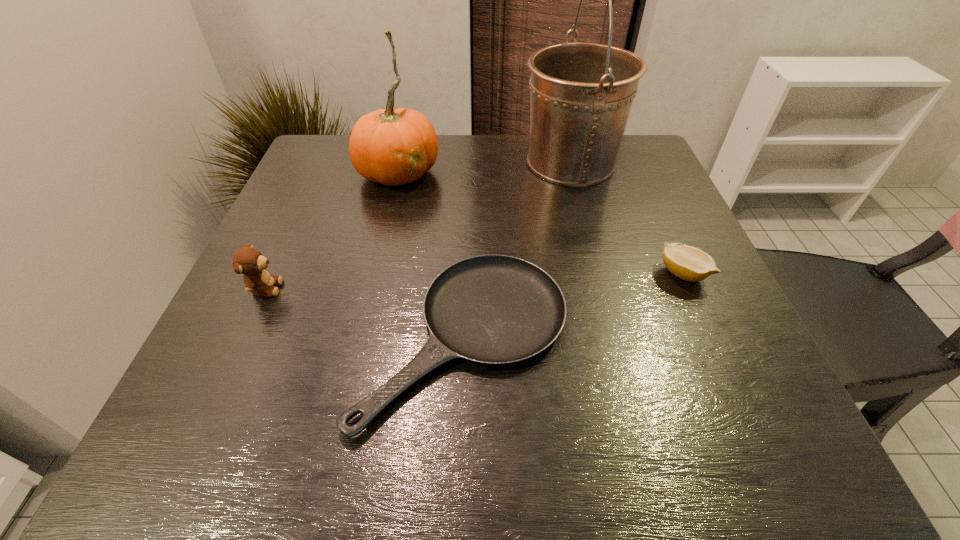
Where is `the tallest object`? the tallest object is located at coordinates (581, 93).

The image size is (960, 540). What are the coordinates of `the second tallest object` in the screenshot? It's located at (393, 147).

Image resolution: width=960 pixels, height=540 pixels. In order to click on the leftmost object in this screenshot , I will do `click(252, 264)`.

You are a GUI agent. You are given a task and a screenshot of the screen. Output one action in this format:
    pyautogui.click(x=<x>, y=<y>)
    Task: Click on the teddy bear
    
    Given the screenshot: What is the action you would take?
    pyautogui.click(x=252, y=264)

Locate an element on the screen. Image resolution: width=960 pixels, height=540 pixels. lemon is located at coordinates (689, 263).

Where is `the shortest object`? The image size is (960, 540). the shortest object is located at coordinates (494, 309).

Identify the location of free spot located on the right of the tallest object. The image size is (960, 540). (640, 163).

You are a GUI agent. You are given a task and a screenshot of the screen. Output one action in this format:
    pyautogui.click(x=<x>, y=<y>)
    Task: Click on the blank space located on the right of the second tallest object
    The image size is (960, 540).
    Given the screenshot: What is the action you would take?
    pyautogui.click(x=594, y=172)

The width and height of the screenshot is (960, 540). I want to click on free space located 0.340m on the face of the third shortest object, so click(x=461, y=288).

At what (x,y) coordinates should I click in order to perform the action: click on free location located 0.070m on the front of the lemon. Please return your answer as a coordinate pair (x, y). This screenshot has width=960, height=540. Looking at the image, I should click on (704, 320).